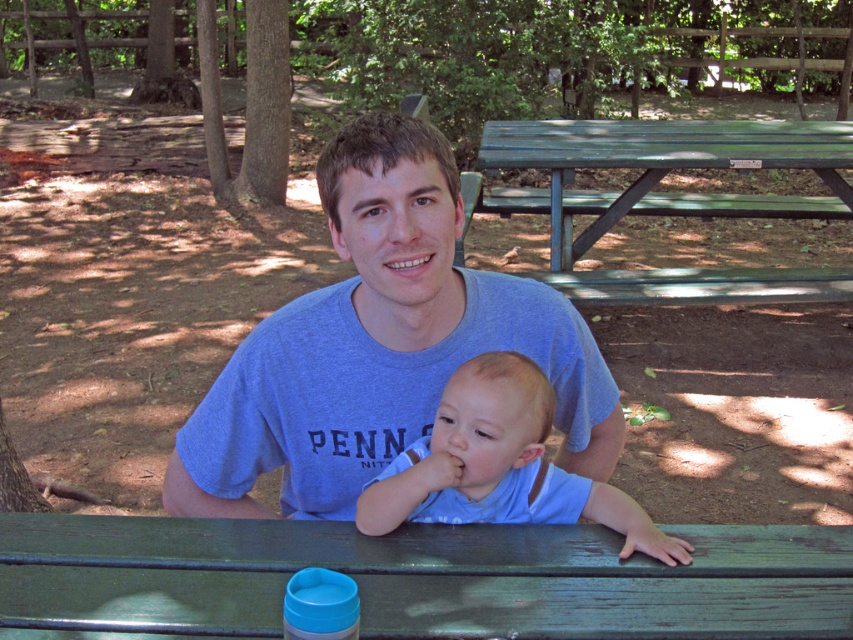
Between green painted wood picnic table at upper center and blue cotton shirt at center, which one has less height?

→ blue cotton shirt at center

This screenshot has width=853, height=640. What do you see at coordinates (659, 170) in the screenshot?
I see `green painted wood picnic table at upper center` at bounding box center [659, 170].

The width and height of the screenshot is (853, 640). I want to click on green painted wood picnic table at upper center, so click(x=659, y=170).

Measure the distance between point (410, 632) and camera.

A distance of 4.53 feet exists between point (410, 632) and camera.

Is green weathered wood table at center above blue cotton shirt at center?

No, green weathered wood table at center is not above blue cotton shirt at center.

The width and height of the screenshot is (853, 640). Find the location of `green weathered wood table at center`. green weathered wood table at center is located at coordinates (422, 579).

Between blue cotton t-shirt at center and blue cotton shirt at center, which one appears on the right side from the viewer's perspective?

Positioned to the right is blue cotton shirt at center.

Between blue cotton t-shirt at center and blue cotton shirt at center, which one appears on the left side from the viewer's perspective?

From the viewer's perspective, blue cotton t-shirt at center appears more on the left side.

Is point (321, 152) positioned after point (575, 490)?

Yes, it is behind point (575, 490).

Locate an element on the screen. blue cotton t-shirt at center is located at coordinates (379, 344).